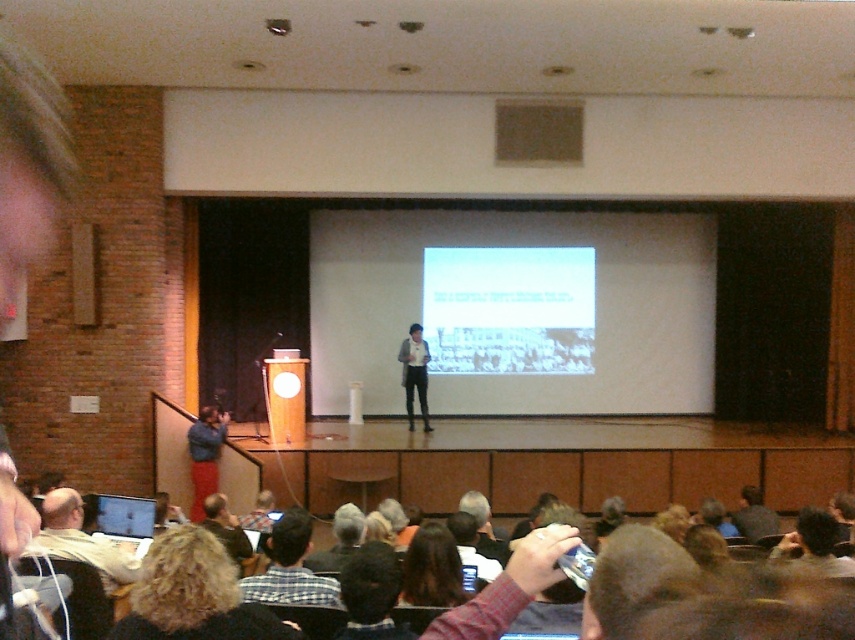
Question: Is light gray fabric shirt at lower left bigger than white shirt at center?

Choices:
 (A) no
 (B) yes

Answer: (A)

Question: Which point is closer to the camera?

Choices:
 (A) curly hair at lower left
 (B) white matte projection screen at center
 (C) light gray fabric shirt at lower left
 (D) white shirt at center

Answer: (A)

Question: Considering the real-world distances, which object is closest to the plaid shirt at center?

Choices:
 (A) dark brown hair at center
 (B) light gray fabric shirt at lower left
 (C) white matte projection screen at center
 (D) curly hair at lower left

Answer: (A)

Question: Where is white matte projection screen at center located in relation to curly hair at lower left in the image?

Choices:
 (A) right
 (B) left

Answer: (A)

Question: Is curly hair at lower left behind dark brown hair at center?

Choices:
 (A) yes
 (B) no

Answer: (B)

Question: Which object appears farthest from the camera in this image?

Choices:
 (A) light gray fabric shirt at lower left
 (B) white shirt at center

Answer: (B)